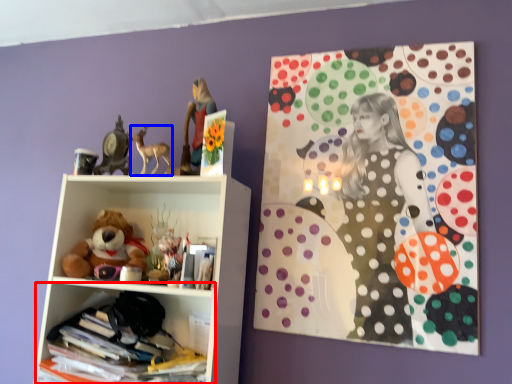
Question: Which object is closer to the camera taking this photo, shelf (highlighted by a red box) or animal (highlighted by a blue box)?

Choices:
 (A) shelf
 (B) animal

Answer: (A)